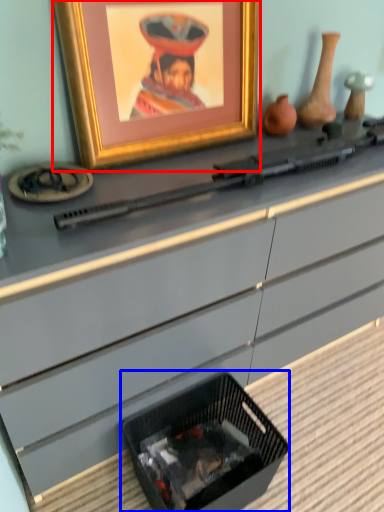
Question: Which object appears closest to the camera in this image, picture frame (highlighted by a red box) or basket (highlighted by a blue box)?

Choices:
 (A) picture frame
 (B) basket

Answer: (A)